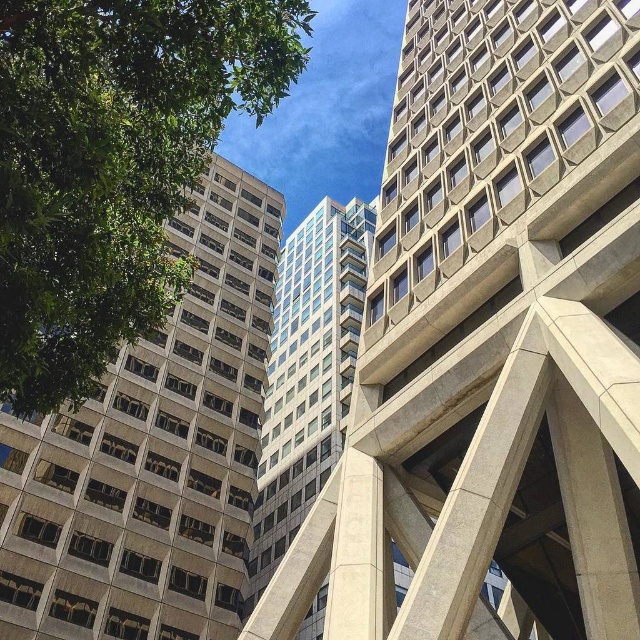
You are a city planner assessing the urban landscape. You notice the green leafy tree at left and the glassy concrete building at center. Which of these two objects is smaller in size?

The green leafy tree at left is smaller in size compared to the glassy concrete building at center.

You are standing at the base of the concrete textured building at center. You want to throw a small ball to reach the top of the building. The ball can travel a maximum distance of 10 meters. Will the ball reach the top?

The concrete textured building at center is 12.34 meters away from camera. Since the ball can only travel 10 meters, it will not reach the top.

You are an architect analyzing the urban scene. You notice two buildings labeled as the concrete textured building at center and the glassy concrete building at center. Which of these two buildings takes up more area in the image?

The glassy concrete building at center occupies more space than the concrete textured building at center according to the description.